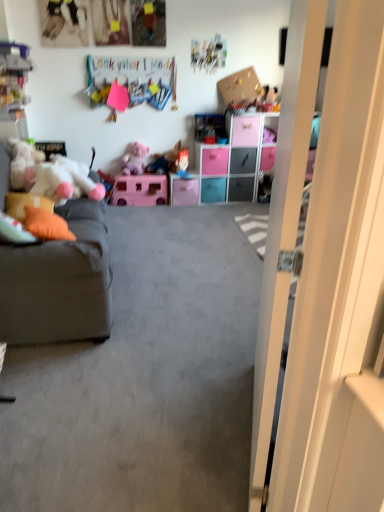
Where is `space that is in front of blue plastic drawer at center, the 2th drawer when ordered from left to right`? This screenshot has width=384, height=512. space that is in front of blue plastic drawer at center, the 2th drawer when ordered from left to right is located at coordinates (211, 209).